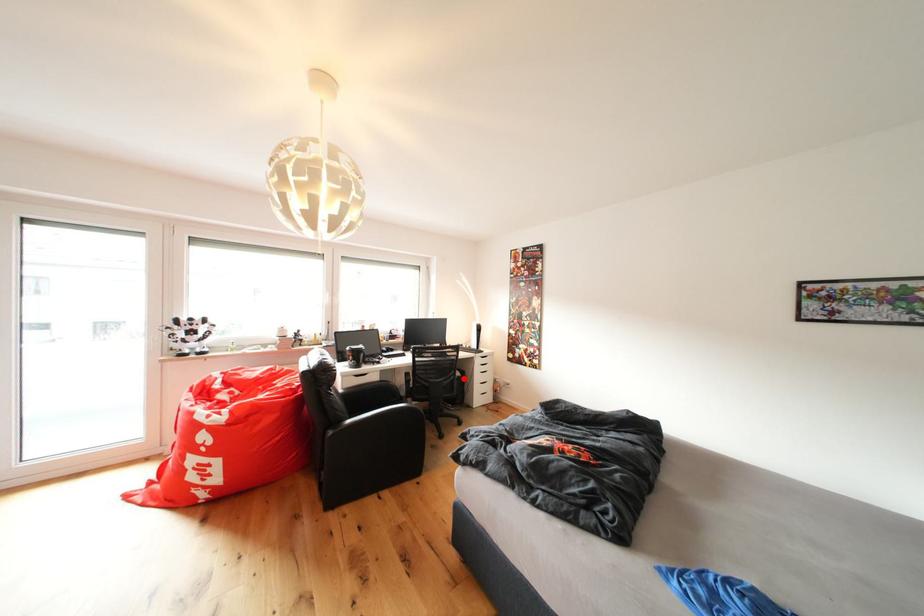
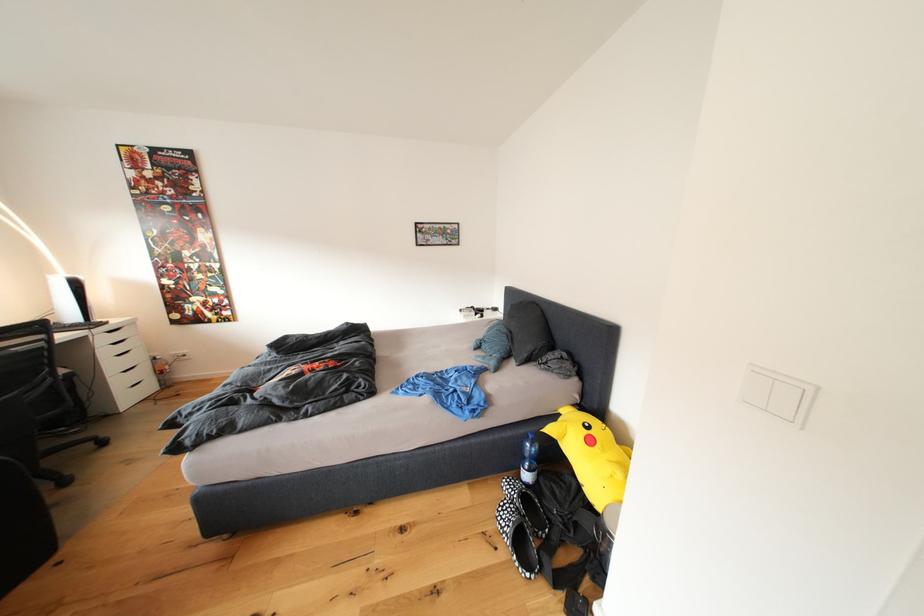
Find the pixel in the second image that matches the highlighted location in the first image.

(63, 378)